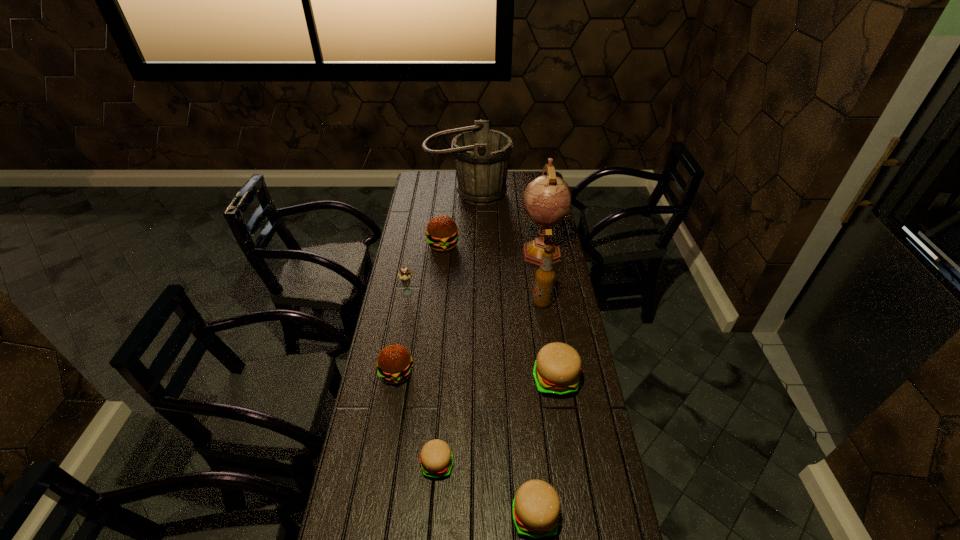
Find the location of a particular element. the second farthest beige hamburger is located at coordinates (436, 460).

Locate an element on the screen. the second nearest hamburger is located at coordinates (436, 460).

Where is `free point located 0.310m on the front-facing side of the pink globe`? The width and height of the screenshot is (960, 540). free point located 0.310m on the front-facing side of the pink globe is located at coordinates (553, 322).

The height and width of the screenshot is (540, 960). What are the coordinates of `free point located 0.290m on the handle side of the bucket` in the screenshot? It's located at (466, 242).

Where is `vacant region located on the front label of the seventh shortest object`? vacant region located on the front label of the seventh shortest object is located at coordinates (438, 303).

Identify the location of vacant point located 0.390m on the front label of the seventh shortest object. (438, 303).

Image resolution: width=960 pixels, height=540 pixels. Identify the location of vacant region located on the front label of the seventh shortest object. (471, 303).

Locate an element on the screen. vacant space located on the right of the icecream is located at coordinates (474, 292).

Where is `vacant area situated on the front of the bigger brown hamburger`? This screenshot has width=960, height=540. vacant area situated on the front of the bigger brown hamburger is located at coordinates (440, 274).

This screenshot has width=960, height=540. I want to click on vacant space located 0.340m on the left of the farthest beige hamburger, so click(x=436, y=380).